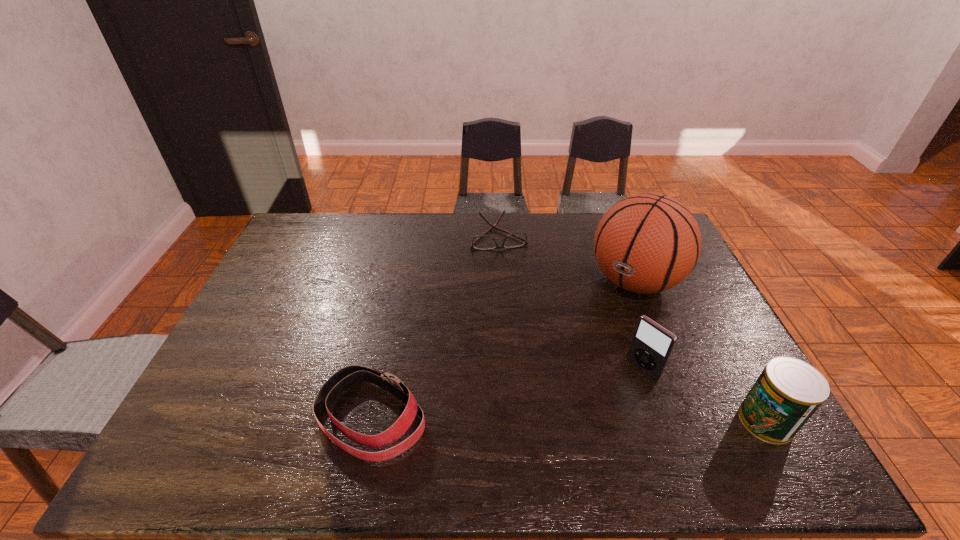
I want to click on dog collar situated at the near edge, so (345, 378).

The height and width of the screenshot is (540, 960). Identify the location of can situated at the near edge. (788, 392).

The width and height of the screenshot is (960, 540). What are the coordinates of `can located in the right edge section of the desktop` in the screenshot? It's located at (788, 392).

Where is `basketball that is at the right edge`? Image resolution: width=960 pixels, height=540 pixels. basketball that is at the right edge is located at coordinates (646, 243).

At what (x,y) coordinates should I click in order to perform the action: click on object that is at the near right corner. Please return your answer as a coordinate pair (x, y). The height and width of the screenshot is (540, 960). Looking at the image, I should click on (788, 392).

This screenshot has width=960, height=540. I want to click on blank space at the far edge, so click(444, 226).

Find the location of `vacant region at the near edge of the desktop`. vacant region at the near edge of the desktop is located at coordinates (369, 402).

At what (x,y) coordinates should I click in order to perform the action: click on blank space at the left edge. Please return your answer as a coordinate pair (x, y). This screenshot has height=540, width=960. Looking at the image, I should click on (279, 255).

The width and height of the screenshot is (960, 540). In order to click on free space at the right edge of the desktop in this screenshot , I will do `click(709, 377)`.

Locate an element on the screen. The height and width of the screenshot is (540, 960). free spot at the far left corner of the desktop is located at coordinates (326, 226).